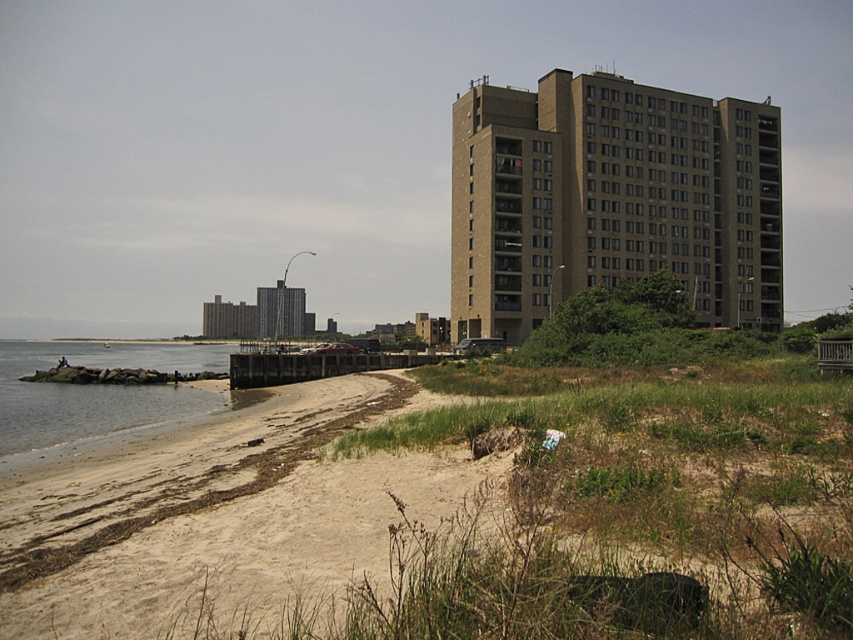
Question: Among these objects, which one is farthest from the camera?

Choices:
 (A) brown brick building at upper right
 (B) sandy beach at lower left
 (C) dark gray concrete building at center

Answer: (C)

Question: Observing the image, what is the correct spatial positioning of brown brick building at upper right in reference to clear water at lower left?

Choices:
 (A) right
 (B) left

Answer: (A)

Question: Estimate the real-world distances between objects in this image. Which object is farther from the brown brick building at upper right?

Choices:
 (A) clear water at lower left
 (B) sandy beach at lower left
 (C) dark gray concrete building at center

Answer: (C)

Question: Can you confirm if clear water at lower left is positioned above dark gray concrete building at center?

Choices:
 (A) no
 (B) yes

Answer: (A)

Question: Which is nearer to the sandy beach at lower left?

Choices:
 (A) clear water at lower left
 (B) brown brick building at upper right

Answer: (A)

Question: Does sandy beach at lower left appear under brown brick building at upper right?

Choices:
 (A) no
 (B) yes

Answer: (B)